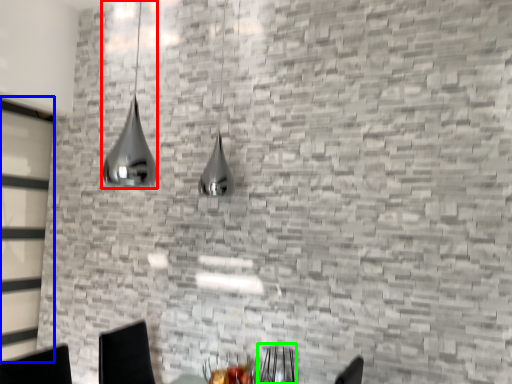
Question: Which is farther away from lamp (highlighted by a red box)? glass door (highlighted by a blue box) or armchair (highlighted by a green box)?

Choices:
 (A) glass door
 (B) armchair

Answer: (B)